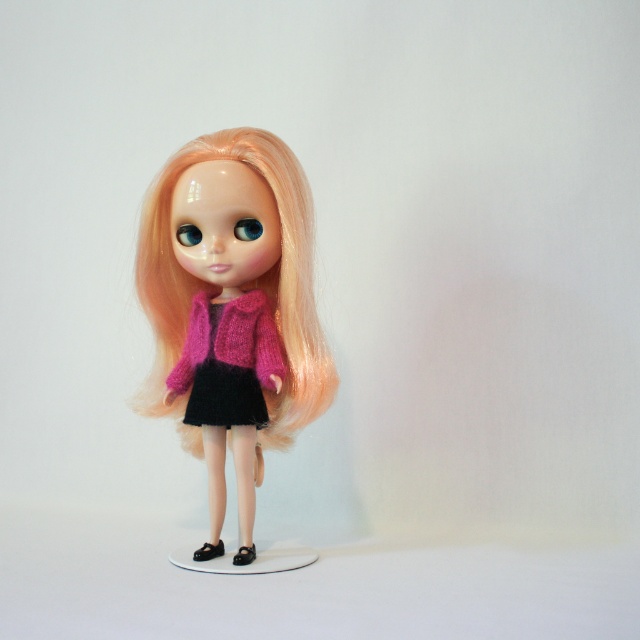
You are a fashion designer examining a doll dressed in two sweaters. The doll has a pink knitted sweater at center and a fuzzy pink sweater at center. Which sweater is taller?

The pink knitted sweater at center is taller than the fuzzy pink sweater at center according to the description.

You are an assistant helping a customer who wants to know which sweater is on the left side of the doll. The customer sees both the pink knitted sweater at center and the fuzzy pink sweater at center. Which one should they point to?

The fuzzy pink sweater at center is on the left side because the pink knitted sweater at center is positioned to its right.

You are an art student analyzing the doll in the image. You notice two points marked on the doll. The first point is at coordinate point (228, 326) and the second is at point (173, 368). Which point is positioned closer to your viewpoint?

Point (228, 326) is closer to the viewer than point (173, 368).